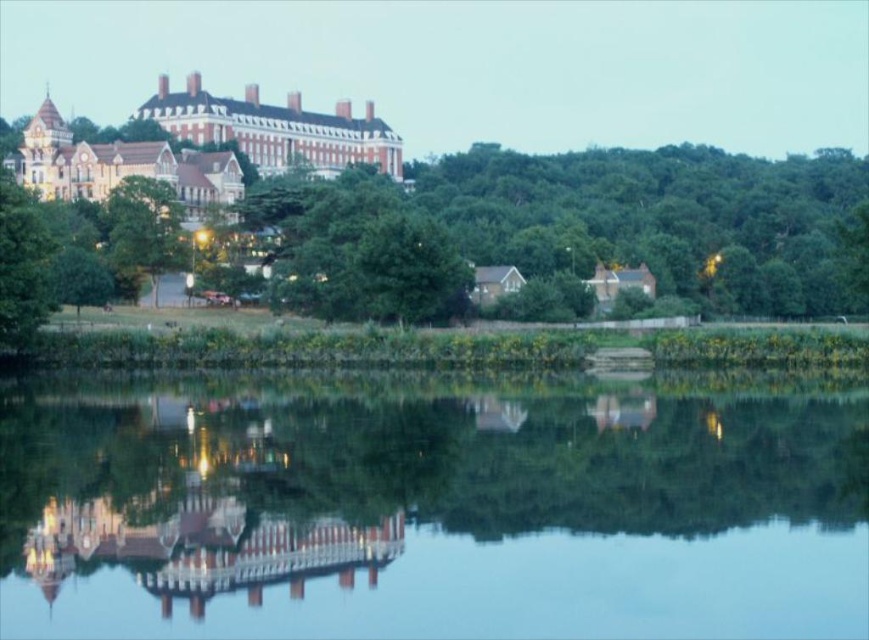
Question: Which of the following is the closest to the observer?

Choices:
 (A) light brown stone building at upper center
 (B) white stone palace at upper left
 (C) green leafy tree at center

Answer: (C)

Question: Is white stone palace at upper left below green leafy tree at center?

Choices:
 (A) no
 (B) yes

Answer: (A)

Question: Estimate the real-world distances between objects in this image. Which object is farther from the green leafy tree at center?

Choices:
 (A) white stone palace at upper left
 (B) light brown stone building at upper center
 (C) transparent glass water at center

Answer: (B)

Question: Can you confirm if light brown stone building at upper center is positioned above white stone palace at upper left?

Choices:
 (A) yes
 (B) no

Answer: (A)

Question: Which of the following is the closest to the observer?

Choices:
 (A) white stone palace at upper left
 (B) transparent glass water at center
 (C) green leafy tree at center

Answer: (B)

Question: Is transparent glass water at center smaller than light brown stone building at upper center?

Choices:
 (A) no
 (B) yes

Answer: (B)